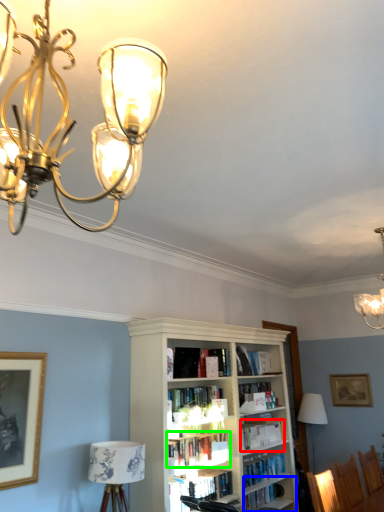
Question: Which object is the farthest from book (highlighted by a red box)? Choose among these: shelf (highlighted by a blue box) or book (highlighted by a green box).

Choices:
 (A) shelf
 (B) book

Answer: (B)